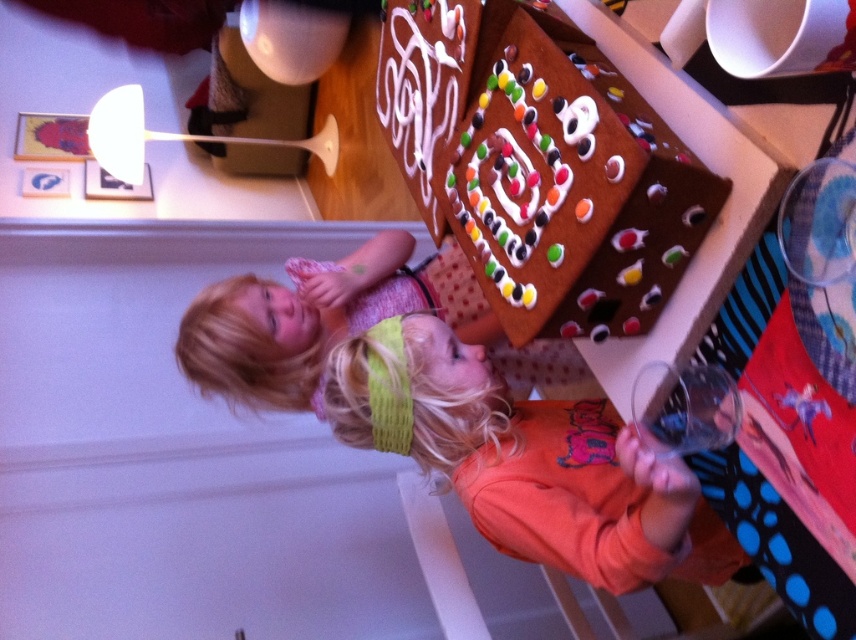
You are a photographer trying to capture a clear shot of both the chocolate frosted gingerbread house at upper center and the orange fleece sweatshirt at center. Based on their positions, can you tell which one is higher in the frame?

The chocolate frosted gingerbread house at upper center is higher in the frame than the orange fleece sweatshirt at center.

You are a parent trying to take a photo of your children and the gingerbread house. You want to ensure that both the chocolate frosted gingerbread house at upper center and the orange fleece sweatshirt at center are fully visible in the frame. Given their sizes, is it possible to capture both without cropping either of them?

The chocolate frosted gingerbread house at upper center is taller than the orange fleece sweatshirt at center. Since the house is taller, as long as the camera angle accommodates the height of the house, the sweatshirt should also fit within the frame.

Based on the scene description, can you determine which object is closer to the viewer between the chocolate frosted gingerbread house at upper center and the orange fleece sweatshirt at center?

The chocolate frosted gingerbread house at upper center is closer to the viewer than the orange fleece sweatshirt at center because it is positioned in front of it.